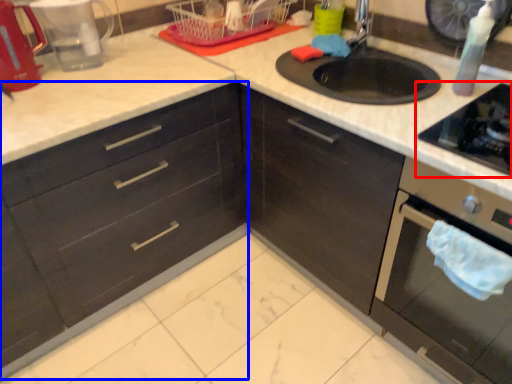
Question: Among these objects, which one is farthest to the camera, gas stove (highlighted by a red box) or cabinetry (highlighted by a blue box)?

Choices:
 (A) gas stove
 (B) cabinetry

Answer: (B)